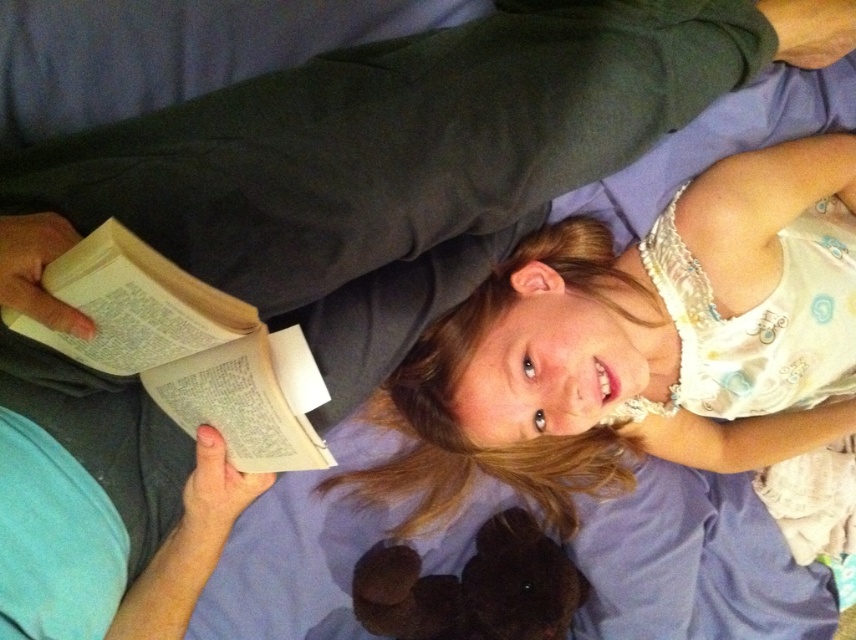
Question: Considering the relative positions of white paper book at left and dark brown plush at lower center in the image provided, where is white paper book at left located with respect to dark brown plush at lower center?

Choices:
 (A) left
 (B) right

Answer: (A)

Question: Is white paper book at left thinner than dark brown plush at lower center?

Choices:
 (A) no
 (B) yes

Answer: (B)

Question: Which of the following is the closest to the observer?

Choices:
 (A) (188, 278)
 (B) (393, 620)

Answer: (A)

Question: Which point is farther from the camera taking this photo?

Choices:
 (A) (740, 380)
 (B) (129, 268)
 (C) (351, 593)

Answer: (C)

Question: Can you confirm if white paper book at left is positioned above dark brown plush at lower center?

Choices:
 (A) yes
 (B) no

Answer: (A)

Question: Which of the following is the closest to the observer?

Choices:
 (A) (424, 436)
 (B) (556, 618)

Answer: (A)